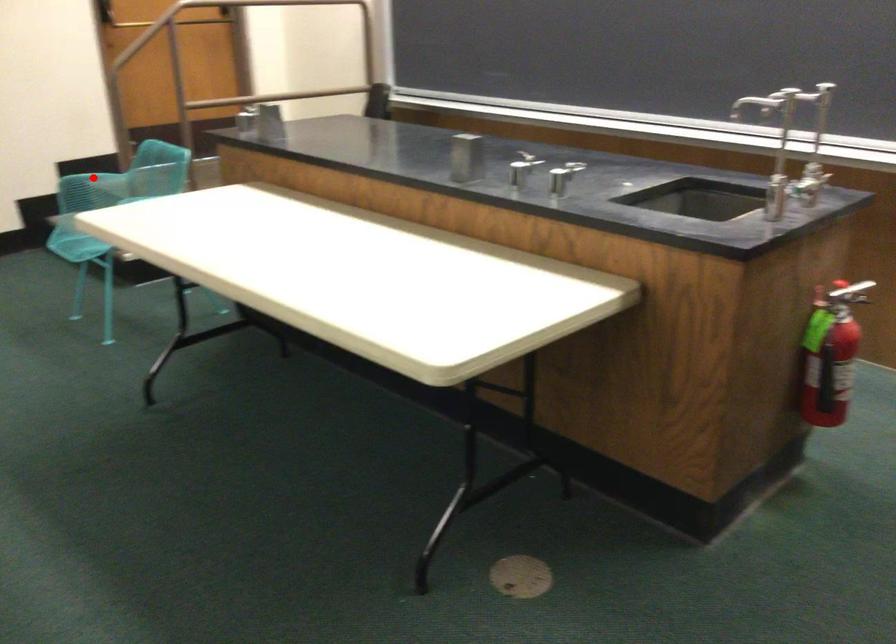
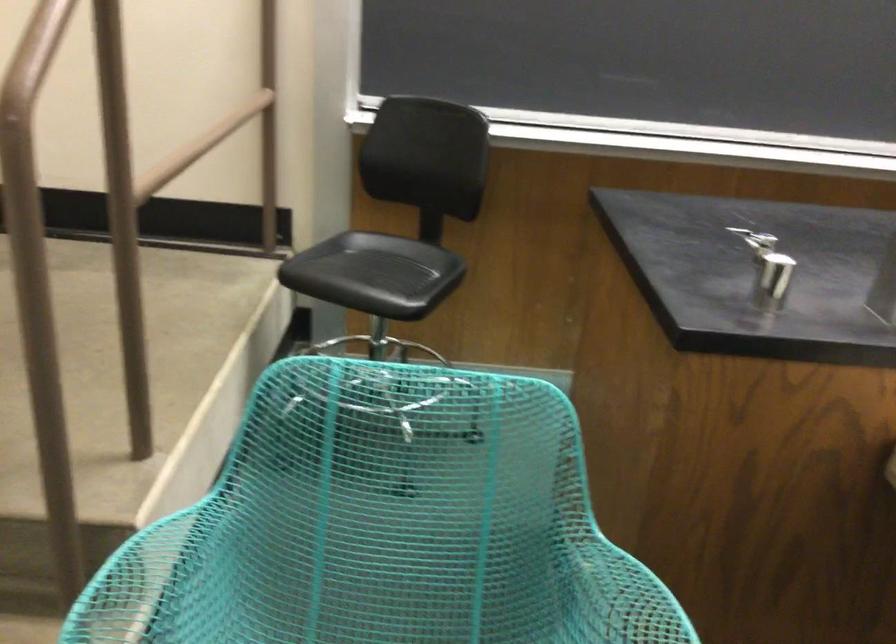
Where in the second image is the point corresponding to the highlighted location from the first image?

(150, 582)